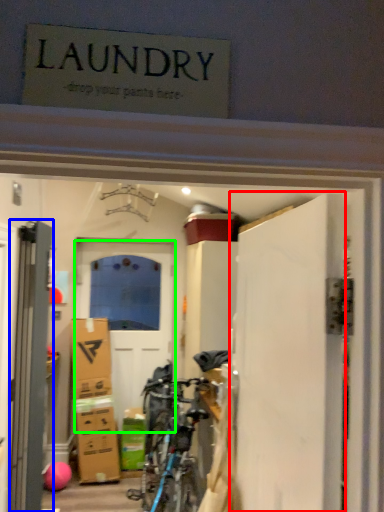
Question: Considering the real-world distances, which object is farthest from door (highlighted by a red box)? door (highlighted by a blue box) or door (highlighted by a green box)?

Choices:
 (A) door
 (B) door

Answer: (B)